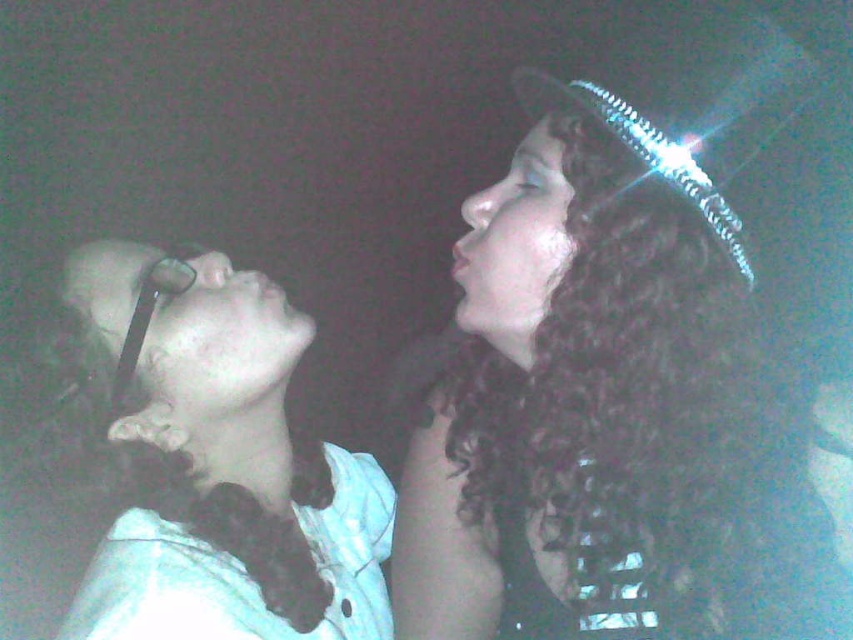
Question: Which object is farther from the camera taking this photo?

Choices:
 (A) white lace collar at upper left
 (B) curly hair at upper right

Answer: (B)

Question: Which point appears farthest from the camera in this image?

Choices:
 (A) click(583, 400)
 (B) click(181, 349)

Answer: (B)

Question: Is curly hair at upper right further to the viewer compared to white lace collar at upper left?

Choices:
 (A) yes
 (B) no

Answer: (A)

Question: Can you confirm if curly hair at upper right is wider than white lace collar at upper left?

Choices:
 (A) no
 (B) yes

Answer: (B)

Question: Which point appears farthest from the camera in this image?

Choices:
 (A) (106, 550)
 (B) (666, 472)

Answer: (B)

Question: Does curly hair at upper right appear under white lace collar at upper left?

Choices:
 (A) no
 (B) yes

Answer: (A)